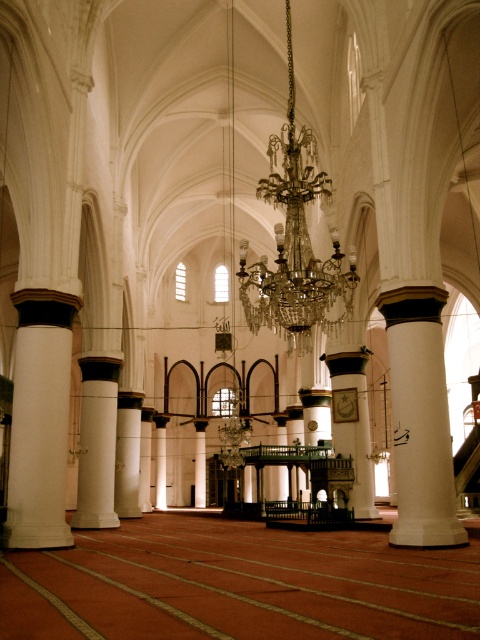
Does white smooth column at center have a greater width compared to white marble pillar at center?

Correct, the width of white smooth column at center exceeds that of white marble pillar at center.

You are a GUI agent. You are given a task and a screenshot of the screen. Output one action in this format:
    pyautogui.click(x=<x>, y=<y>)
    Task: Click on the white smooth column at center
    This screenshot has height=640, width=480.
    Given the screenshot: What is the action you would take?
    pyautogui.click(x=420, y=419)

You are a GUI agent. You are given a task and a screenshot of the screen. Output one action in this format:
    pyautogui.click(x=<x>, y=<y>)
    Task: Click on the white smooth column at center
    This screenshot has height=640, width=480.
    Given the screenshot: What is the action you would take?
    pyautogui.click(x=420, y=419)

Who is more distant from viewer, (403,420) or (98,474)?

The point (98,474) is more distant.

Does white smooth column at center have a larger size compared to white marble column at left?

No, white smooth column at center is not bigger than white marble column at left.

I want to click on white smooth column at center, so (420, 419).

What do you see at coordinates (420, 419) in the screenshot? Image resolution: width=480 pixels, height=640 pixels. I see `white smooth column at center` at bounding box center [420, 419].

Does white smooth column at center lie behind crystal glass chandelier at center?

No, white smooth column at center is in front of crystal glass chandelier at center.

Which is in front, point (402, 536) or point (300, 168)?

Point (402, 536) is more forward.

Find the location of a particular element. white smooth column at center is located at coordinates (420, 419).